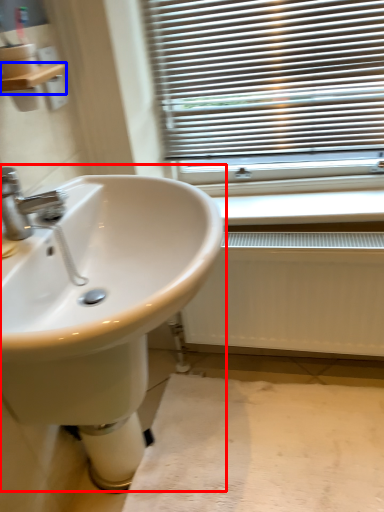
Question: Among these objects, which one is farthest to the camera, sink (highlighted by a red box) or balustrade (highlighted by a blue box)?

Choices:
 (A) sink
 (B) balustrade

Answer: (B)